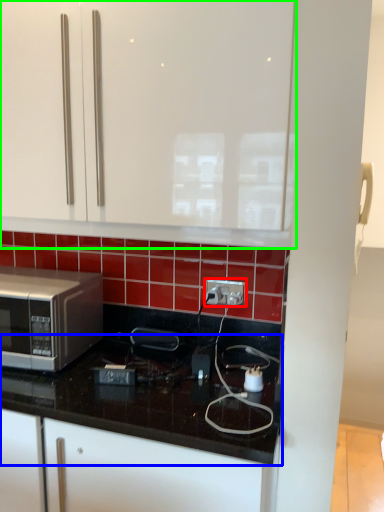
Question: Which object is the farthest from electric outlet (highlighted by a red box)? Choose among these: countertop (highlighted by a blue box) or cabinetry (highlighted by a green box).

Choices:
 (A) countertop
 (B) cabinetry

Answer: (B)